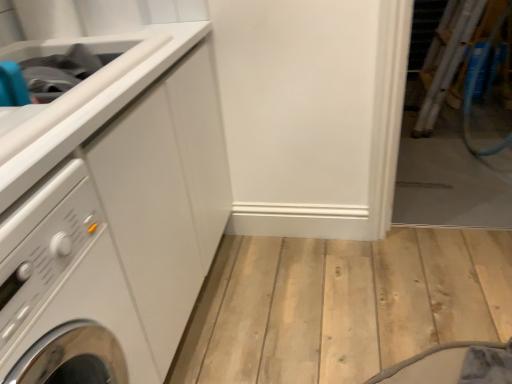
Question: Considering their positions, is white glossy washing machine at left located in front of or behind matte white sink at upper left?

Choices:
 (A) behind
 (B) front

Answer: (B)

Question: Is white glossy washing machine at left inside or outside of matte white sink at upper left?

Choices:
 (A) outside
 (B) inside

Answer: (A)

Question: Which is farther from the matte white sink at upper left?

Choices:
 (A) white glossy washing machine at left
 (B) white glossy counter top at upper left

Answer: (A)

Question: Estimate the real-world distances between objects in this image. Which object is closer to the white glossy counter top at upper left?

Choices:
 (A) white glossy washing machine at left
 (B) matte white sink at upper left

Answer: (B)